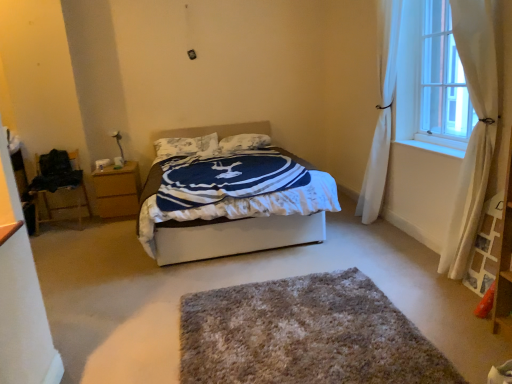
Question: Is white sheer curtain at upper right wider than white soft pillow at center, marked as the 2th pillow in a left-to-right arrangement?

Choices:
 (A) yes
 (B) no

Answer: (B)

Question: Is white sheer curtain at upper right closer to the viewer compared to white soft pillow at center, marked as the 2th pillow in a left-to-right arrangement?

Choices:
 (A) yes
 (B) no

Answer: (A)

Question: From a real-world perspective, does white sheer curtain at upper right stand above white soft pillow at center, acting as the 1th pillow starting from the right?

Choices:
 (A) yes
 (B) no

Answer: (A)

Question: From the image's perspective, is white sheer curtain at upper right over white soft pillow at center, marked as the 2th pillow in a left-to-right arrangement?

Choices:
 (A) no
 (B) yes

Answer: (B)

Question: Does white sheer curtain at upper right appear on the right side of white soft pillow at center, marked as the 2th pillow in a left-to-right arrangement?

Choices:
 (A) no
 (B) yes

Answer: (B)

Question: Is textured white pillow at center, which is the first pillow in left-to-right order, wider or thinner than shaggy gray rug at center?

Choices:
 (A) thin
 (B) wide

Answer: (A)

Question: From a real-world perspective, is textured white pillow at center, which is the first pillow in left-to-right order, above or below shaggy gray rug at center?

Choices:
 (A) above
 (B) below

Answer: (A)

Question: From the image's perspective, is textured white pillow at center, which is the first pillow in left-to-right order, located above or below shaggy gray rug at center?

Choices:
 (A) below
 (B) above

Answer: (B)

Question: Looking at the image, does textured white pillow at center, marked as the 2th pillow in a right-to-left arrangement, seem bigger or smaller compared to shaggy gray rug at center?

Choices:
 (A) small
 (B) big

Answer: (A)

Question: From their relative heights in the image, would you say white sheer curtain at upper right is taller or shorter than white soft bed at center?

Choices:
 (A) tall
 (B) short

Answer: (A)

Question: Considering the positions of white sheer curtain at upper right and white soft bed at center in the image, is white sheer curtain at upper right wider or thinner than white soft bed at center?

Choices:
 (A) wide
 (B) thin

Answer: (B)

Question: Do you think white sheer curtain at upper right is within white soft bed at center, or outside of it?

Choices:
 (A) outside
 (B) inside

Answer: (A)

Question: Considering the positions of point (454, 104) and point (246, 243), is point (454, 104) closer or farther from the camera than point (246, 243)?

Choices:
 (A) closer
 (B) farther

Answer: (B)

Question: Is textured white pillow at center, which is the first pillow in left-to-right order, inside or outside of wooden chair at left?

Choices:
 (A) outside
 (B) inside

Answer: (A)

Question: From a real-world perspective, is textured white pillow at center, marked as the 2th pillow in a right-to-left arrangement, positioned above or below wooden chair at left?

Choices:
 (A) above
 (B) below

Answer: (A)